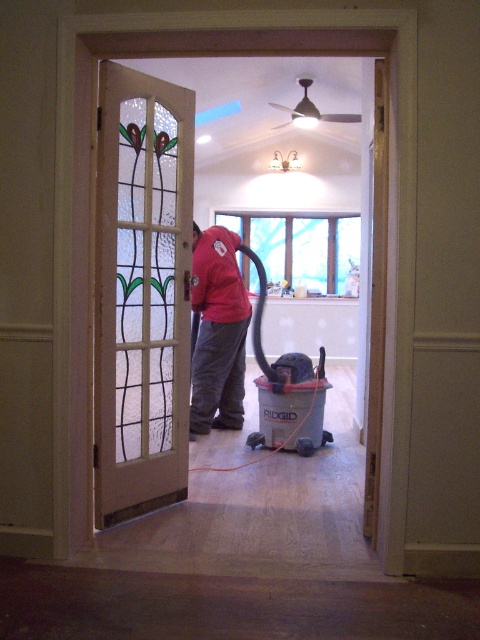
From the picture: You are standing at the entrance of the room and see two points marked in the scene. Which point is closer to you, the point at coordinates (96, 349) or the point at (204, 236)?

Point (96, 349) is in front of point (204, 236), so it is closer to you.